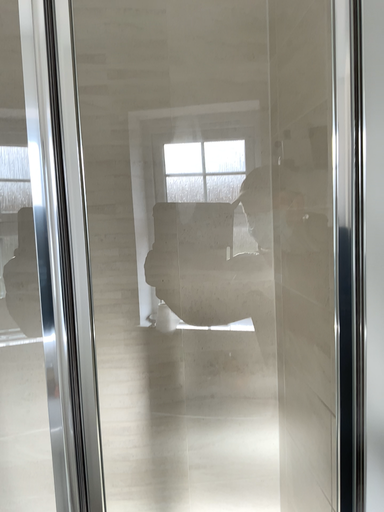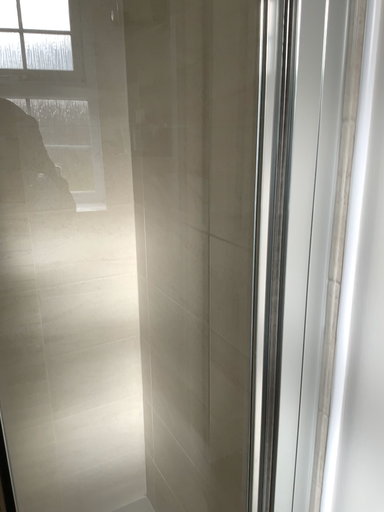
Question: Which way did the camera rotate in the video?

Choices:
 (A) rotated downward
 (B) rotated upward

Answer: (A)